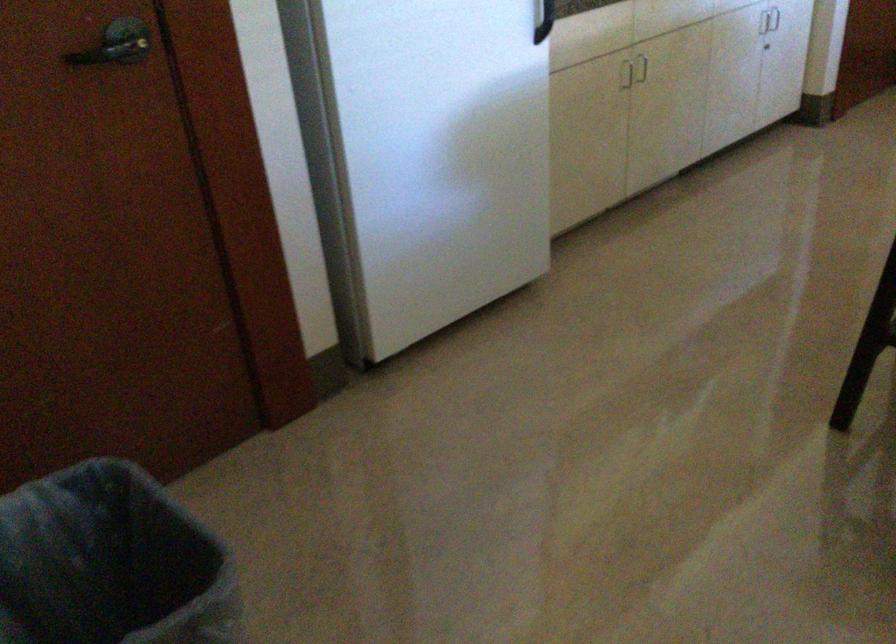
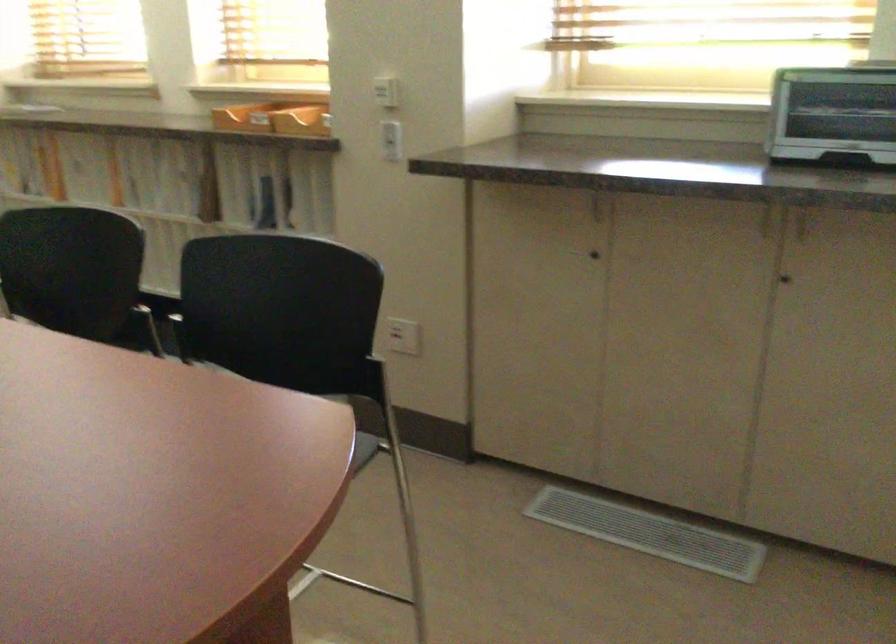
How did the camera likely rotate?

The camera's rotation is toward right-down.